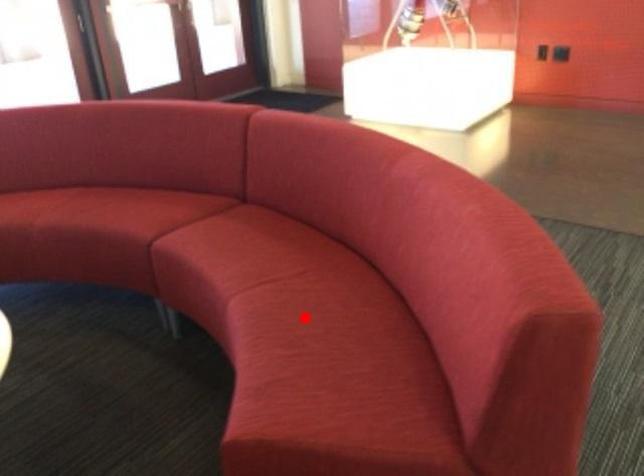
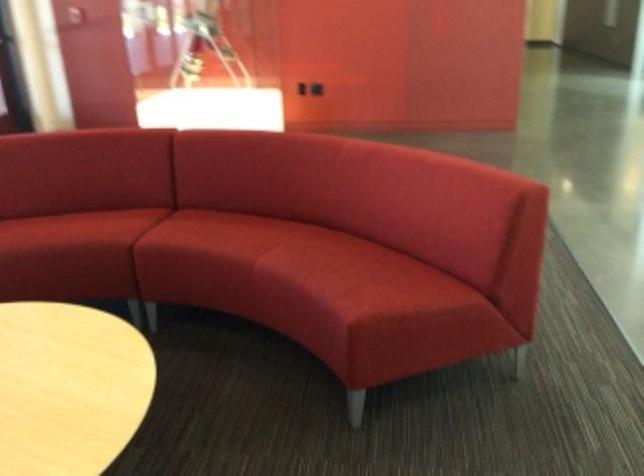
Question: I am providing you with two images of the same scene from different viewpoints. A red point is shown in image1. For the corresponding object point in image2, is it positioned nearer or farther from the camera?

Choices:
 (A) Nearer
 (B) Farther

Answer: (B)